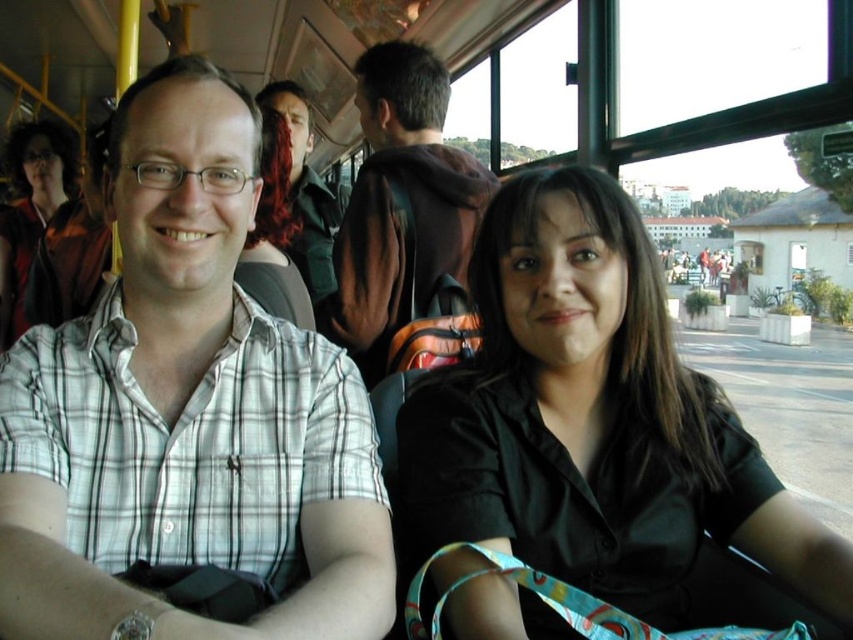
Between point (387, 106) and point (303, 280), which one is positioned in front?

Point (387, 106) is in front.

Is point (399, 227) less distant than point (310, 170)?

Yes, point (399, 227) is closer to viewer.

Is point (434, 128) farther from viewer compared to point (258, 92)?

No.

You are a GUI agent. You are given a task and a screenshot of the screen. Output one action in this format:
    pyautogui.click(x=<x>, y=<y>)
    Task: Click on the brown suede jacket at center
    This screenshot has height=640, width=853.
    Given the screenshot: What is the action you would take?
    pyautogui.click(x=401, y=209)

Which is more to the right, matte black jacket at upper left or green military vest at center?

Positioned to the right is green military vest at center.

Does matte black jacket at upper left have a larger size compared to green military vest at center?

Indeed, matte black jacket at upper left has a larger size compared to green military vest at center.

Does point (57, 140) lie behind point (335, 220)?

Yes, point (57, 140) is farther from viewer.

Locate an element on the screen. matte black jacket at upper left is located at coordinates tap(32, 209).

Which is below, white checkered shirt at center or green military vest at center?

white checkered shirt at center is lower down.

Where is `white checkered shirt at center`? white checkered shirt at center is located at coordinates (186, 412).